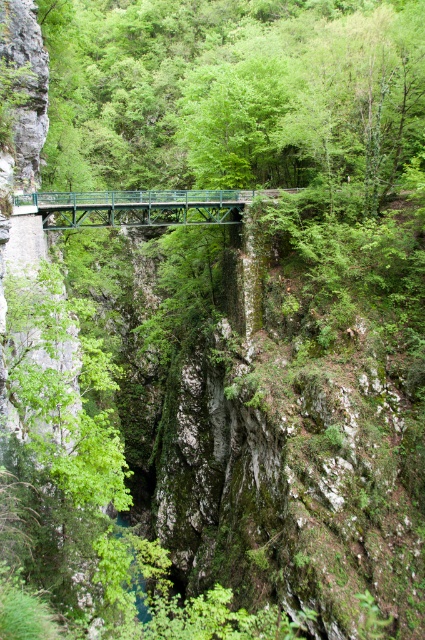
You are a hiker standing on the green metallic bridge at center and want to take a photo of the green leafy tree at center. Which direction should you face to capture it in your shot?

The green leafy tree at center is to the right of the green metallic bridge at center, so you should face to the right to capture it in your shot.

You are standing at the edge of the canyon looking towards the metal bridge. There is a green leafy tree marked at point (232, 92). Is the tree closer to you or farther away compared to the metal bridge?

The point (232, 92) marks the green leafy tree at center, which is farther away than the metal bridge since the bridge spans across the canyon and the tree is positioned centrally in the scene.